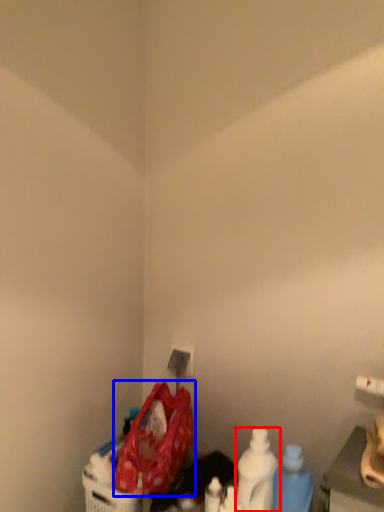
Question: Which object appears farthest to the camera in this image, bottle (highlighted by a red box) or waste (highlighted by a blue box)?

Choices:
 (A) bottle
 (B) waste

Answer: (A)